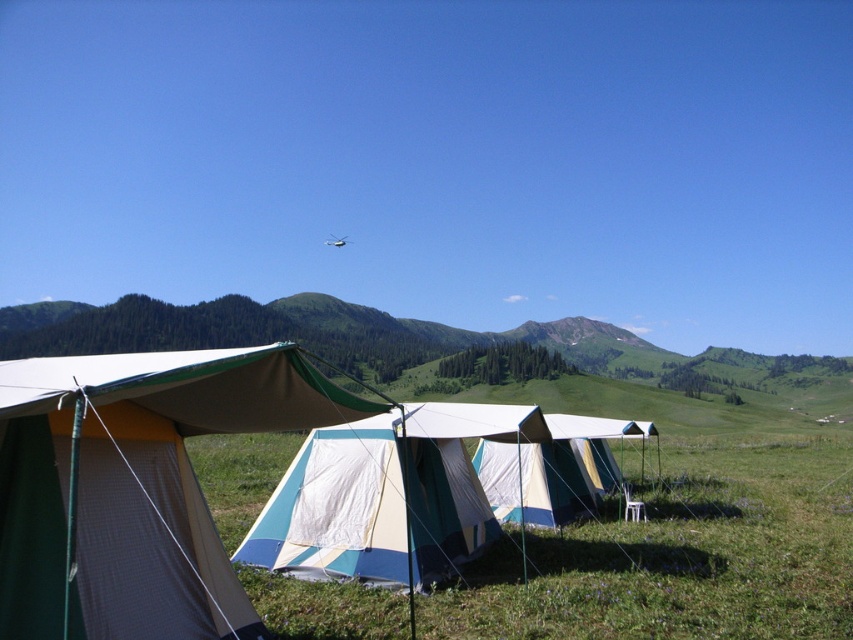
Question: Can you confirm if matte canvas tent at left is thinner than white canvas tent at center?

Choices:
 (A) yes
 (B) no

Answer: (B)

Question: Which point is closer to the camera taking this photo?

Choices:
 (A) [x=138, y=536]
 (B) [x=386, y=477]

Answer: (A)

Question: Can you confirm if matte canvas tent at left is positioned to the right of white canvas tent at center?

Choices:
 (A) no
 (B) yes

Answer: (A)

Question: Which point is farther to the camera?

Choices:
 (A) matte canvas tent at left
 (B) white canvas tent at center

Answer: (B)

Question: Among these objects, which one is farthest from the camera?

Choices:
 (A) white canvas tent at center
 (B) matte canvas tent at left

Answer: (A)

Question: From the image, what is the correct spatial relationship of matte canvas tent at left in relation to white canvas tent at center?

Choices:
 (A) right
 (B) left

Answer: (B)